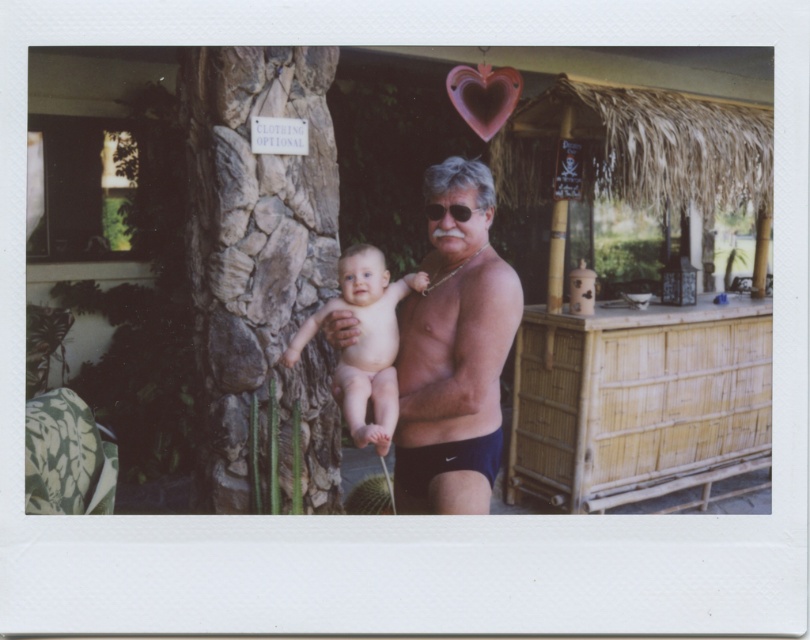
Between bamboo hut at center and muscular tan skin at center, which one has less height?

muscular tan skin at center is shorter.

Is point (544, 417) less distant than point (416, 349)?

No.

Between point (437, 429) and point (421, 388), which one is positioned in front?

Point (421, 388)

I want to click on bamboo hut at center, so click(403, 269).

Which is above, brown rough stone tree trunk at left or dark blue nylon shorts at center?

brown rough stone tree trunk at left is above.

Who is more forward, (241, 116) or (501, 449)?

Point (501, 449) is more forward.

This screenshot has width=810, height=640. Describe the element at coordinates (259, 268) in the screenshot. I see `brown rough stone tree trunk at left` at that location.

Where is `brown rough stone tree trunk at left`? brown rough stone tree trunk at left is located at coordinates (259, 268).

Is point (233, 200) positioned before point (450, 404)?

No.

Is brown rough stone tree trunk at left behind muscular tan skin at center?

Yes, brown rough stone tree trunk at left is further from the viewer.

Identify the location of brown rough stone tree trunk at left. The image size is (810, 640). (259, 268).